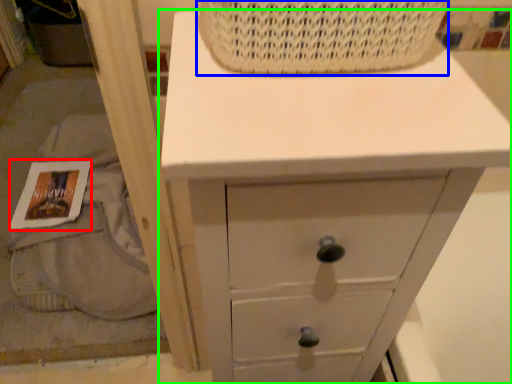
Question: Which object is positioned closest to magazine (highlighted by a red box)? Select from basket (highlighted by a blue box) and chest of drawers (highlighted by a green box).

Choices:
 (A) basket
 (B) chest of drawers

Answer: (B)